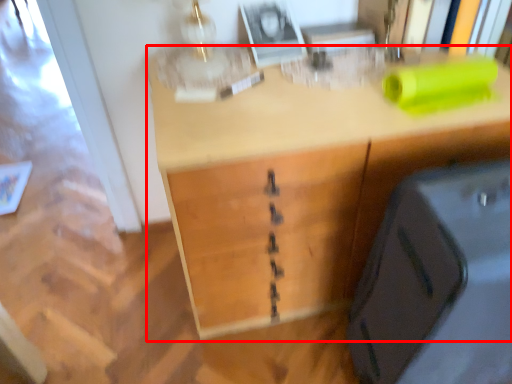
Question: From the image, what is the correct spatial relationship of desk (annotated by the red box) in relation to luggage?

Choices:
 (A) left
 (B) right

Answer: (A)